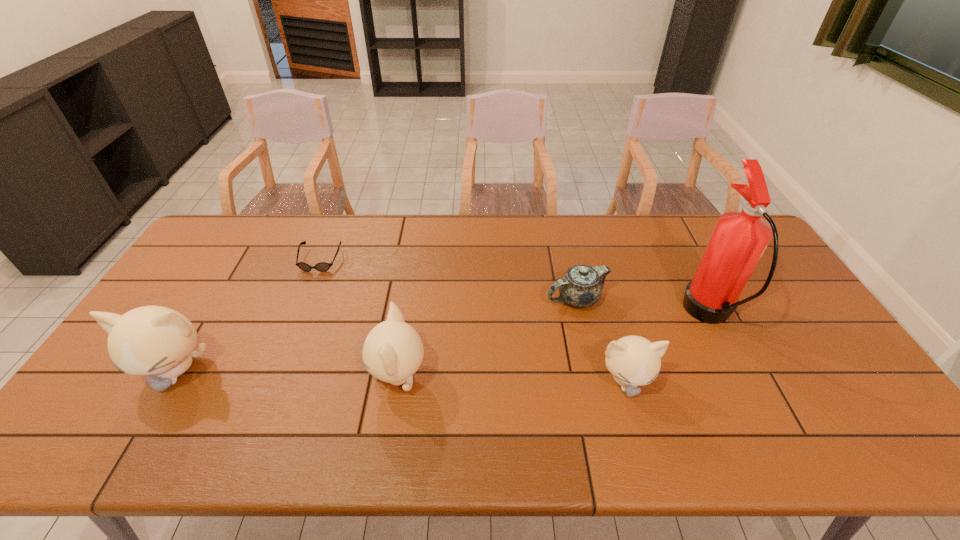
The image size is (960, 540). Identify the location of free space located 0.180m on the face of the fourth shortest object. (300, 376).

Locate an element on the screen. The image size is (960, 540). vacant area situated 0.310m on the face of the fourth shortest object is located at coordinates [x=250, y=376].

Where is `vacant space located on the face of the fourth shortest object`? The image size is (960, 540). vacant space located on the face of the fourth shortest object is located at coordinates (227, 376).

What are the coordinates of `vacant space situated 0.390m on the lenses of the sunglasses` in the screenshot? It's located at (274, 375).

This screenshot has width=960, height=540. I want to click on vacant space located 0.190m from the spout of the second shortest object, so click(482, 299).

The image size is (960, 540). What are the coordinates of `vacant area situated 0.260m from the spout of the second shortest object` in the screenshot? It's located at (459, 299).

Where is `vacant space located from the spout of the second shortest object`? vacant space located from the spout of the second shortest object is located at coordinates (469, 299).

The width and height of the screenshot is (960, 540). I want to click on vacant space located at the spray nozzle of the rightmost object, so click(644, 315).

I want to click on vacant space positioned at the spray nozzle of the rightmost object, so click(x=658, y=315).

Where is `free space located 0.110m at the spray nozzle of the rightmost object`? free space located 0.110m at the spray nozzle of the rightmost object is located at coordinates (647, 315).